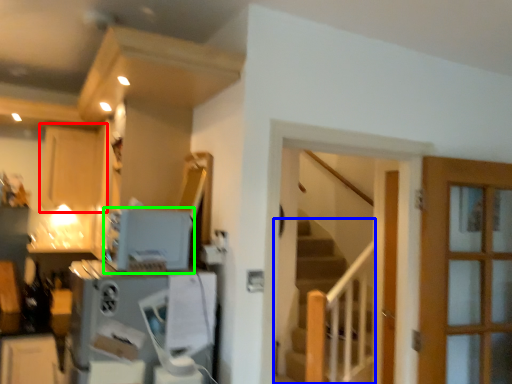
Question: Which is farther away from cabinetry (highlighted by a red box)? stairs (highlighted by a blue box) or appliance (highlighted by a green box)?

Choices:
 (A) stairs
 (B) appliance

Answer: (A)